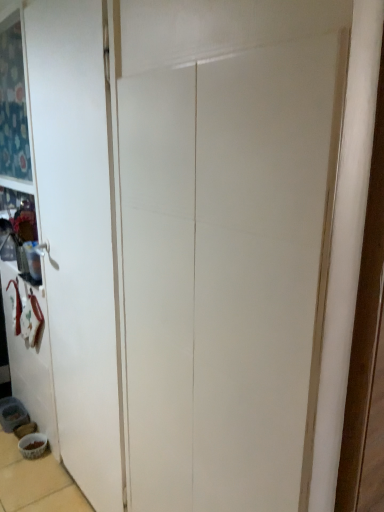
Question: Does point (19, 440) appear closer or farther from the camera than point (96, 195)?

Choices:
 (A) closer
 (B) farther

Answer: (B)

Question: Is white glossy bowl at lower left situated inside white matte door at left or outside?

Choices:
 (A) inside
 (B) outside

Answer: (B)

Question: Based on their sizes in the image, would you say white glossy bowl at lower left is bigger or smaller than white matte door at left?

Choices:
 (A) big
 (B) small

Answer: (B)

Question: Choose the correct answer: Is white matte door at left inside white glossy bowl at lower left or outside it?

Choices:
 (A) inside
 (B) outside

Answer: (B)

Question: Relative to white glossy bowl at lower left, is white matte door at left in front or behind?

Choices:
 (A) front
 (B) behind

Answer: (A)

Question: Is point (39, 36) positioned closer to the camera than point (39, 440)?

Choices:
 (A) closer
 (B) farther

Answer: (A)

Question: From the image's perspective, is white matte door at left located above or below white glossy bowl at lower left?

Choices:
 (A) below
 (B) above

Answer: (B)